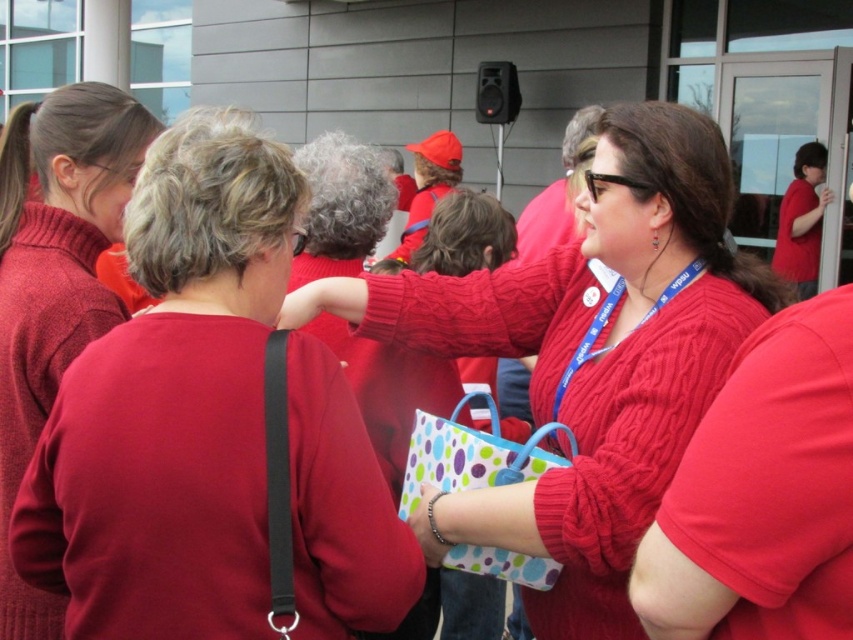
You are at an event and need to locate the registration desk. You see a matte red sweater at upper left and a blue fabric lanyard at center. Which object is closer to the left side of the scene?

The matte red sweater at upper left is positioned on the left side of the blue fabric lanyard at center, so the matte red sweater at upper left is closer to the left side of the scene.